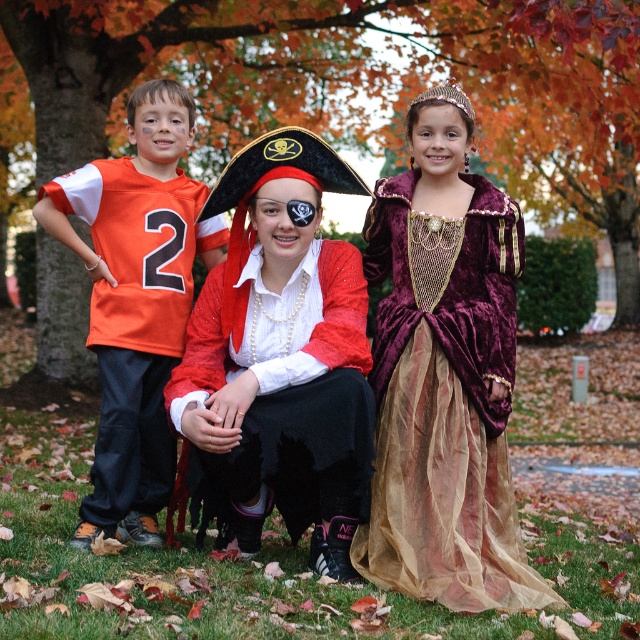
Between shiny red fabric pirate costume at center and orange jersey at left, which one appears on the left side from the viewer's perspective?

orange jersey at left

Between point (173, 419) and point (112, 444), which one is positioned behind?

Positioned behind is point (112, 444).

This screenshot has width=640, height=640. Find the location of `shiny red fabric pirate costume at center`. shiny red fabric pirate costume at center is located at coordinates coord(282,353).

Does velvet maroon dress at center have a lesser height compared to orange jersey at left?

No, velvet maroon dress at center is not shorter than orange jersey at left.

Which is more to the right, velvet maroon dress at center or orange jersey at left?

From the viewer's perspective, velvet maroon dress at center appears more on the right side.

Locate an element on the screen. This screenshot has width=640, height=640. velvet maroon dress at center is located at coordinates (444, 376).

Locate an element on the screen. Image resolution: width=640 pixels, height=640 pixels. velvet maroon dress at center is located at coordinates (444, 376).

In the scene shown: Who is taller, velvet maroon dress at center or shiny red fabric pirate costume at center?

velvet maroon dress at center is taller.

Is velvet maroon dress at center wider than shiny red fabric pirate costume at center?

Incorrect, velvet maroon dress at center's width does not surpass shiny red fabric pirate costume at center's.

Is point (461, 314) in front of point (305, 284)?

Yes, it is.

You are a GUI agent. You are given a task and a screenshot of the screen. Output one action in this format:
    pyautogui.click(x=<x>, y=<y>)
    Task: Click on the velvet maroon dress at center
    
    Given the screenshot: What is the action you would take?
    pyautogui.click(x=444, y=376)